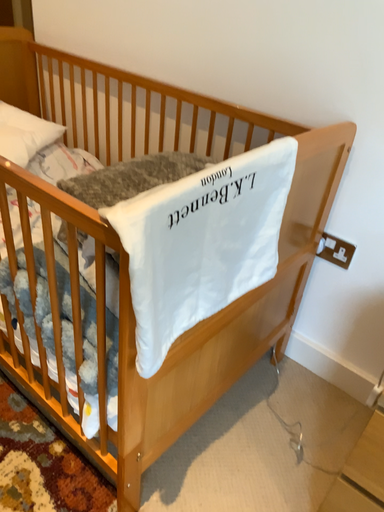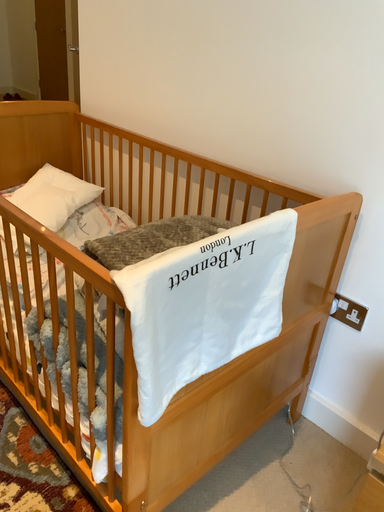
Question: Which way did the camera rotate in the video?

Choices:
 (A) rotated downward
 (B) rotated upward

Answer: (B)